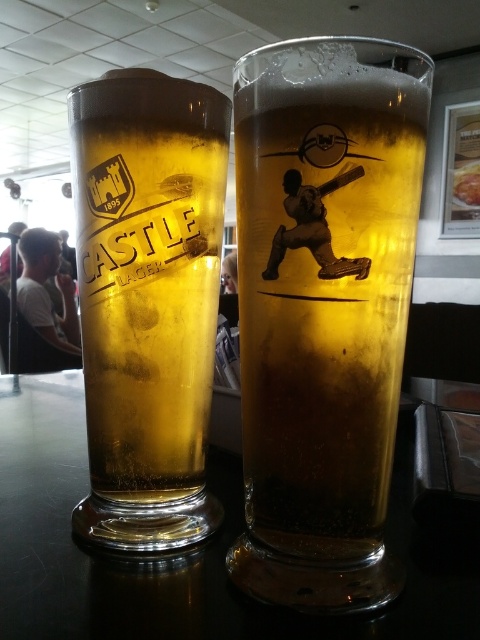
You are setting up a table for a party and want to place the clear glass castle lager at left and the transparent glass table at center. Considering their sizes, which object should you place first to ensure stability?

The clear glass castle lager at left is smaller than the transparent glass table at center. Therefore, you should place the transparent glass table at center first to provide a stable base for the smaller object.

You are holding a smartphone and want to take a photo of the point at coordinate point (169, 106). The smartphone has a minimum focus distance of 10 inches. Will the smartphone be able to focus on the point?

The point at coordinate point (169, 106) is 9.95 inches away from the viewer, which is less than the smartphone minimum focus distance of 10 inches. Therefore, the smartphone will not be able to focus on the point.

You are setting up a table for a party and want to place the clear glass castle lager at left and the transparent glass table at center. Considering their sizes, which object is narrower?

The clear glass castle lager at left is narrower than the transparent glass table at center because its width is less than the table.